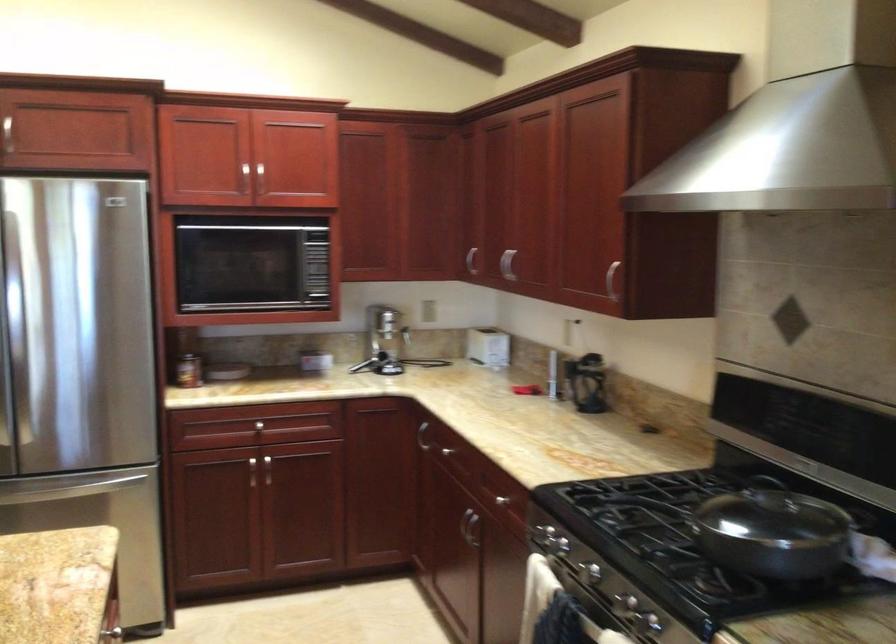
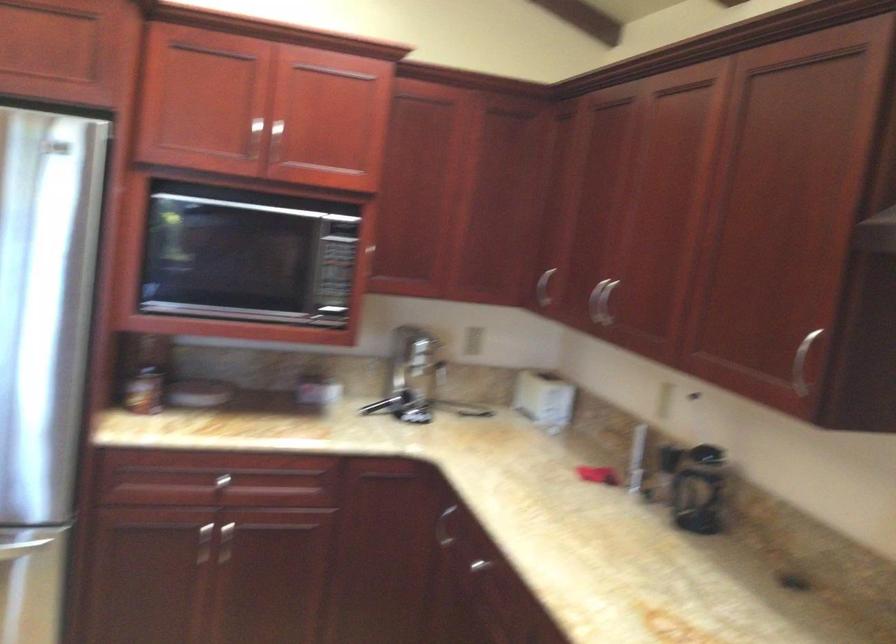
Question: The first image is from the beginning of the video and the second image is from the end. How did the camera likely rotate when shooting the video?

Choices:
 (A) Left
 (B) Right
 (C) Up
 (D) Down

Answer: (A)